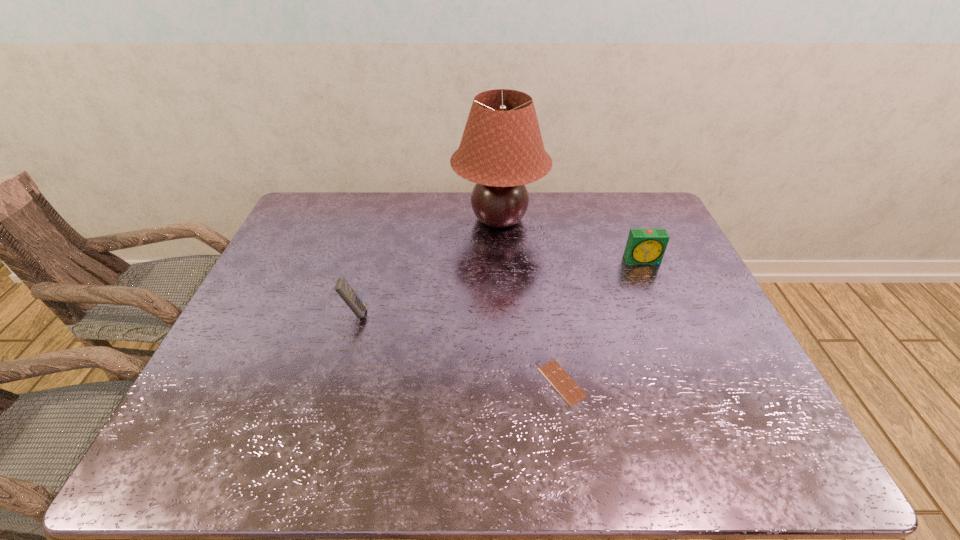
What are the coordinates of `free region at the far right corner of the desktop` in the screenshot? It's located at (639, 205).

I want to click on free point between the tallest object and the leftmost object, so click(427, 266).

Image resolution: width=960 pixels, height=540 pixels. Identify the location of vacant space that is in between the third farthest object and the second farthest object. tap(498, 287).

The width and height of the screenshot is (960, 540). In order to click on vacant point located between the third nearest object and the tallest object in this screenshot , I will do `click(571, 240)`.

Identify the location of empty space that is in between the tallest object and the rightmost object. (571, 240).

Identify the location of vacant region between the rightmost object and the second nearest object. (498, 287).

You are a GUI agent. You are given a task and a screenshot of the screen. Output one action in this format:
    pyautogui.click(x=<x>, y=<y>)
    Task: Click on the free spot between the shortest object and the rightmost object
    This screenshot has width=960, height=540.
    Given the screenshot: What is the action you would take?
    click(x=602, y=321)

I want to click on free space between the shortest object and the third farthest object, so click(459, 347).

Where is `free space between the lampshade and the third nearest object`? free space between the lampshade and the third nearest object is located at coordinates (571, 240).

You are a GUI agent. You are given a task and a screenshot of the screen. Output one action in this format:
    pyautogui.click(x=<x>, y=<y>)
    Task: Click on the unoccupied area between the rightmost object and the third farthest object
    Image resolution: width=960 pixels, height=540 pixels.
    Given the screenshot: What is the action you would take?
    pyautogui.click(x=498, y=287)